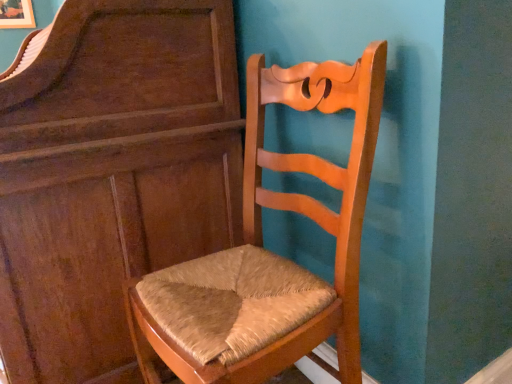
Question: Does matte brown dresser at center have a larger size compared to light brown wood chair at center?

Choices:
 (A) yes
 (B) no

Answer: (A)

Question: From a real-world perspective, is matte brown dresser at center located beneath light brown wood chair at center?

Choices:
 (A) yes
 (B) no

Answer: (B)

Question: Does matte brown dresser at center have a smaller size compared to light brown wood chair at center?

Choices:
 (A) no
 (B) yes

Answer: (A)

Question: Is matte brown dresser at center positioned with its back to light brown wood chair at center?

Choices:
 (A) yes
 (B) no

Answer: (B)

Question: From the image's perspective, is matte brown dresser at center over light brown wood chair at center?

Choices:
 (A) no
 (B) yes

Answer: (B)

Question: Considering the relative sizes of matte brown dresser at center and light brown wood chair at center in the image provided, is matte brown dresser at center thinner than light brown wood chair at center?

Choices:
 (A) yes
 (B) no

Answer: (B)

Question: Is light brown wood chair at center shorter than matte brown dresser at center?

Choices:
 (A) no
 (B) yes

Answer: (B)

Question: Is light brown wood chair at center bigger than matte brown dresser at center?

Choices:
 (A) no
 (B) yes

Answer: (A)

Question: Is light brown wood chair at center oriented away from matte brown dresser at center?

Choices:
 (A) no
 (B) yes

Answer: (A)

Question: From the image's perspective, is light brown wood chair at center located above matte brown dresser at center?

Choices:
 (A) no
 (B) yes

Answer: (A)

Question: Is light brown wood chair at center smaller than matte brown dresser at center?

Choices:
 (A) no
 (B) yes

Answer: (B)

Question: Is the position of light brown wood chair at center less distant than that of matte brown dresser at center?

Choices:
 (A) no
 (B) yes

Answer: (B)

Question: Is light brown wood chair at center inside the boundaries of matte brown dresser at center, or outside?

Choices:
 (A) inside
 (B) outside

Answer: (B)